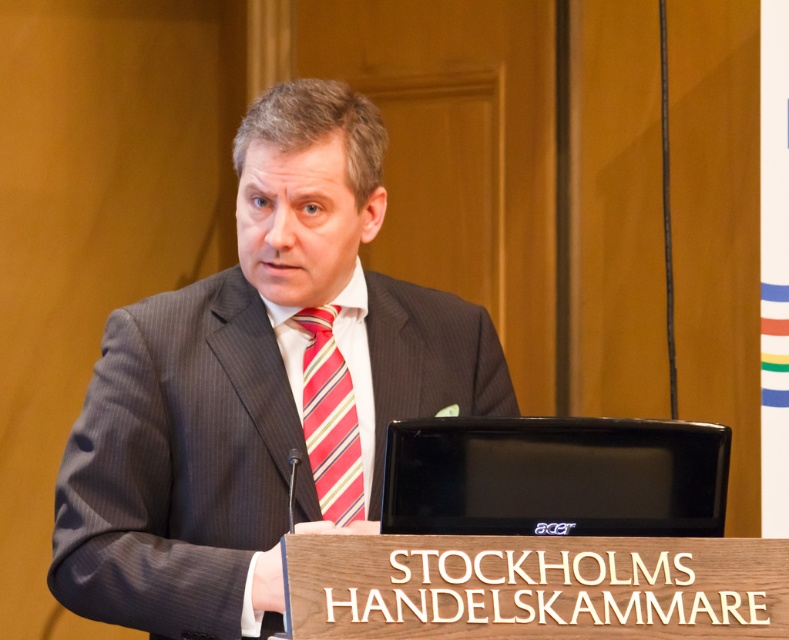
Question: Is dark gray pinstripe suit at center below striped fabric tie at center?

Choices:
 (A) no
 (B) yes

Answer: (B)

Question: Among these objects, which one is farthest from the camera?

Choices:
 (A) striped fabric tie at center
 (B) dark gray pinstripe suit at center

Answer: (A)

Question: Can you confirm if dark gray pinstripe suit at center is smaller than striped fabric tie at center?

Choices:
 (A) yes
 (B) no

Answer: (B)

Question: In this image, where is dark gray pinstripe suit at center located relative to striped fabric tie at center?

Choices:
 (A) above
 (B) below

Answer: (B)

Question: Which point is closer to the camera?

Choices:
 (A) (328, 464)
 (B) (215, 564)

Answer: (B)